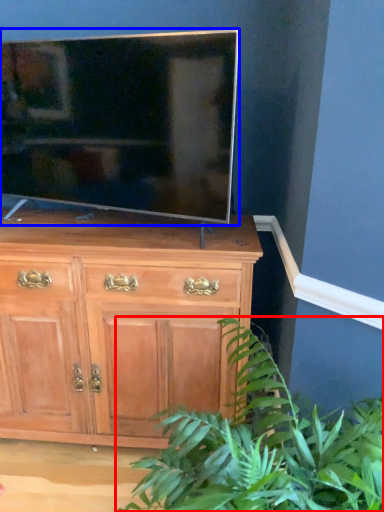
Question: Which object appears closest to the camera in this image, houseplant (highlighted by a red box) or television (highlighted by a blue box)?

Choices:
 (A) houseplant
 (B) television

Answer: (A)